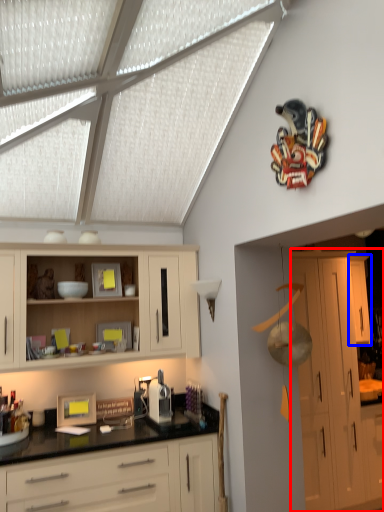
Question: Which object is further to the camera taking this photo, cabinetry (highlighted by a red box) or cabinetry (highlighted by a blue box)?

Choices:
 (A) cabinetry
 (B) cabinetry

Answer: (B)